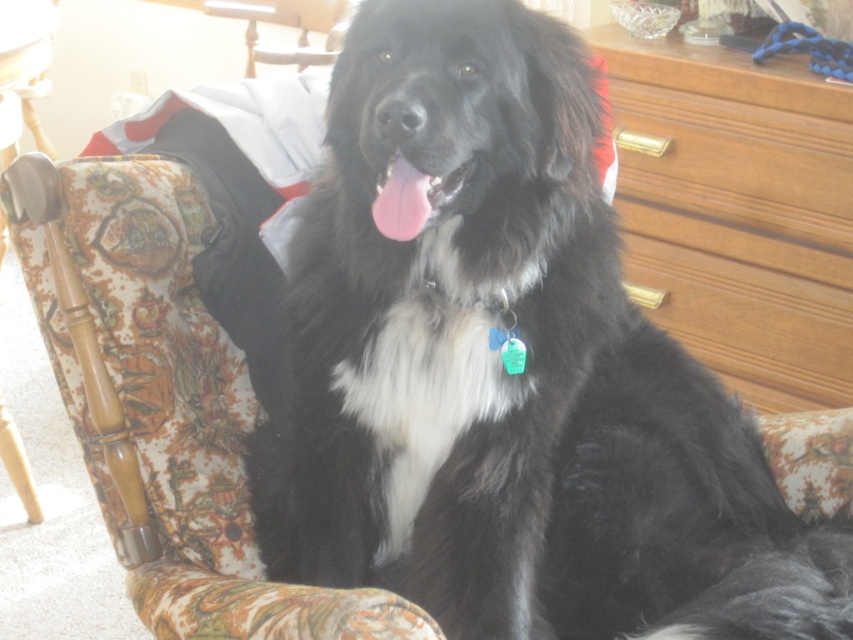
Question: Considering the relative positions of floral fabric pillow at lower right and pink glossy tongue at center in the image provided, where is floral fabric pillow at lower right located with respect to pink glossy tongue at center?

Choices:
 (A) above
 (B) below

Answer: (B)

Question: Does floral fabric pillow at lower right appear on the left side of pink glossy tongue at center?

Choices:
 (A) no
 (B) yes

Answer: (A)

Question: Is black soft fur dog at center above wooden at upper right?

Choices:
 (A) yes
 (B) no

Answer: (B)

Question: Which of the following is the closest to the observer?

Choices:
 (A) pink glossy tongue at center
 (B) wooden at upper right
 (C) floral fabric pillow at lower right
 (D) wooden chair at center

Answer: (A)

Question: Among these points, which one is farthest from the camera?

Choices:
 (A) [802, 438]
 (B) [509, 292]
 (C) [752, 348]

Answer: (C)

Question: Which point is farther from the camera taking this photo?

Choices:
 (A) (534, 81)
 (B) (224, 10)

Answer: (B)